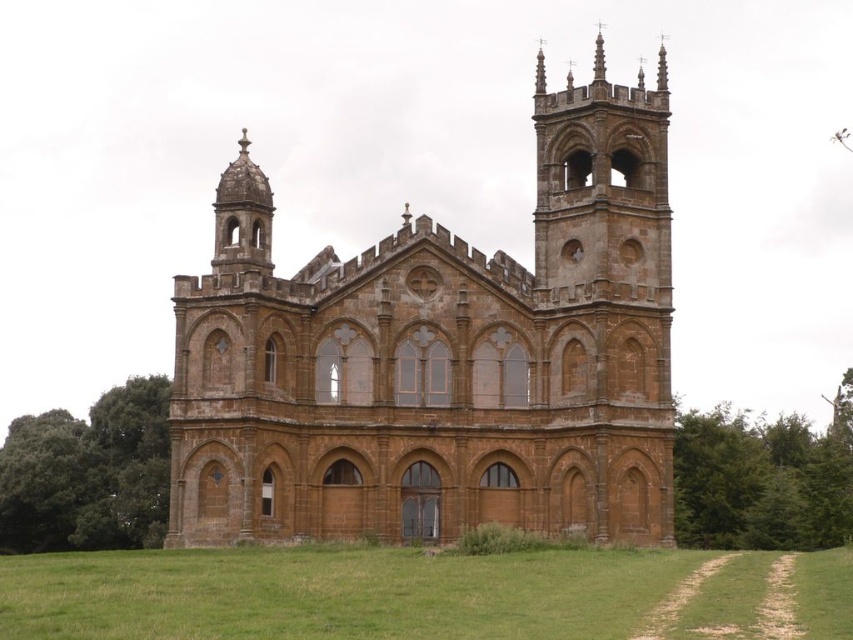
Based on the photo, you are standing in a park and see the brown stone church at center and the green grass at lower center. Which object is closer to you?

The brown stone church at center is closer to you because it is further to the viewer than the green grass at lower center.